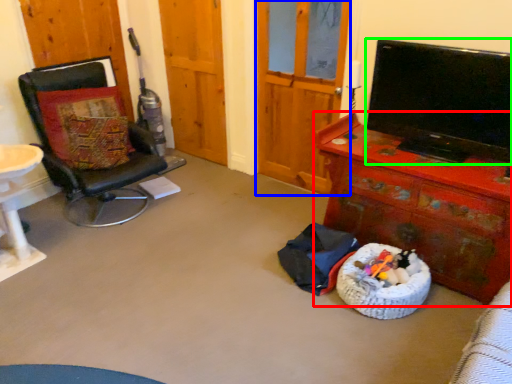
Question: Considering the real-world distances, which object is closest to desk (highlighted by a red box)? screen door (highlighted by a blue box) or television (highlighted by a green box).

Choices:
 (A) screen door
 (B) television

Answer: (B)